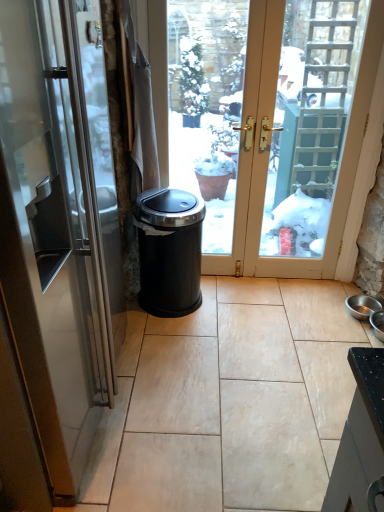
The image size is (384, 512). Identify the location of spots to the right of black plastic trash can at center. (248, 303).